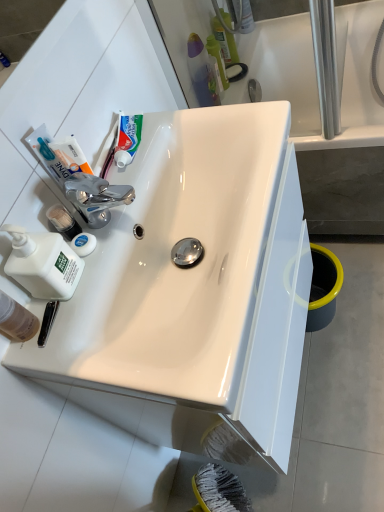
Question: From a real-world perspective, is white matte liquid soap at left above or below translucent plastic toothbrush at upper center?

Choices:
 (A) above
 (B) below

Answer: (A)

Question: Looking at the image, does white matte liquid soap at left seem bigger or smaller compared to translucent plastic toothbrush at upper center?

Choices:
 (A) small
 (B) big

Answer: (B)

Question: Which object is the closest to the white glossy sink at center?

Choices:
 (A) translucent plastic mouthwash at lower left
 (B) white matte liquid soap at left
 (C) green matte toothpaste at upper center
 (D) white glossy bathtub at upper right
 (E) translucent plastic toothbrush at upper center

Answer: (B)

Question: Based on their relative distances, which object is farther from the green matte toothpaste at upper center?

Choices:
 (A) translucent plastic mouthwash at lower left
 (B) white glossy bathtub at upper right
 (C) translucent plastic toothbrush at upper center
 (D) white glossy sink at center
 (E) white matte liquid soap at left

Answer: (C)